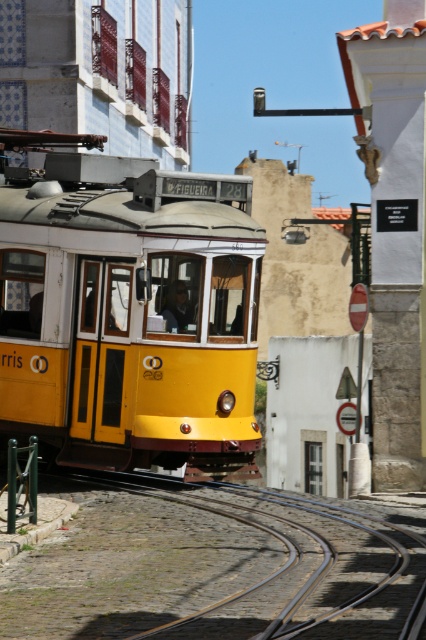
You are a pedestrian standing on the sidewalk next to the yellow matte train at center and the black metal train track at lower center. Which object is closer to your right side?

The black metal train track at lower center is closer to your right side because the yellow matte train at center is positioned to the left of it.

You are a photographer standing on the cobblestone street. You want to take a photo of the yellow matte train at center and the black metal train track at lower center. Which object will appear larger in your photo?

The yellow matte train at center will appear larger in the photo because it is closer to the viewer than the black metal train track at lower center.